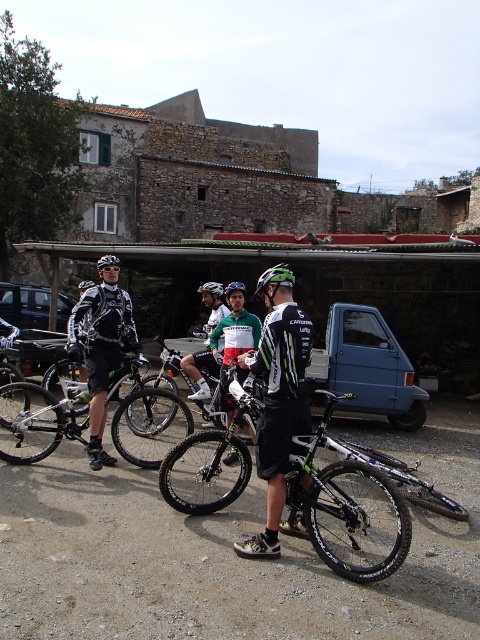
Question: Which point is closer to the camera taking this photo?

Choices:
 (A) (116, 266)
 (B) (257, 444)
 (C) (370, 547)

Answer: (B)

Question: Does black matte car at center lie behind black matte bicycle helmet at upper left?

Choices:
 (A) no
 (B) yes

Answer: (B)

Question: Among these objects, which one is farthest from the camera?

Choices:
 (A) black matte car at center
 (B) black matte helmet at center
 (C) green matte bicycle helmet at center

Answer: (A)

Question: Does metallic blue car at left come behind black matte bicycle helmet at upper left?

Choices:
 (A) no
 (B) yes

Answer: (B)

Question: Can you confirm if black rubber bicycle at center is smaller than black matte helmet at center?

Choices:
 (A) no
 (B) yes

Answer: (B)

Question: Which object is the closest to the black matte car at center?

Choices:
 (A) black matte bicycle helmet at upper left
 (B) black matte bicycle at center
 (C) matte black helmet at center

Answer: (A)